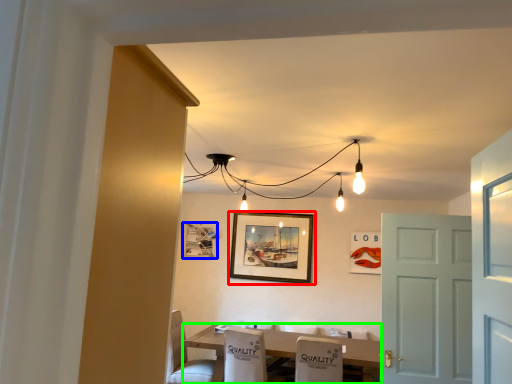
Question: Which is farther away from picture frame (highlighted by a red box)? picture frame (highlighted by a blue box) or table (highlighted by a green box)?

Choices:
 (A) picture frame
 (B) table

Answer: (B)